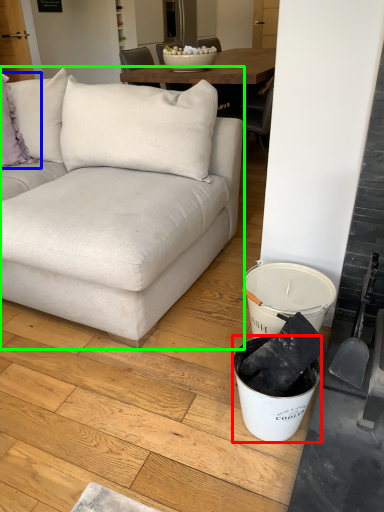
Question: Which is farther away from bucket (highlighted by a red box)? pillow (highlighted by a blue box) or studio couch (highlighted by a green box)?

Choices:
 (A) pillow
 (B) studio couch

Answer: (A)